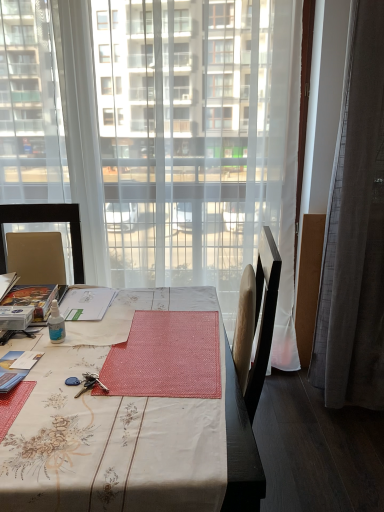
What are the coordinates of `free space behind transparent plastic bottle at table center` in the screenshot? It's located at (90, 316).